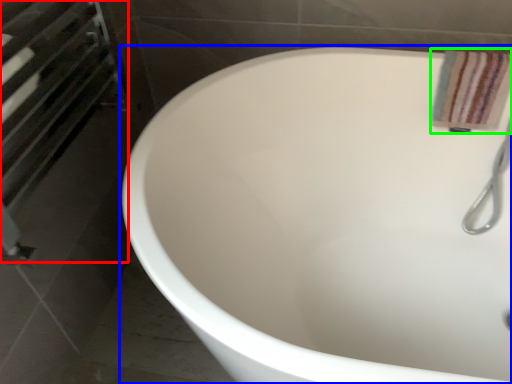
Question: Which object is positioned closest to screen door (highlighted by a red box)? Select from bathtub (highlighted by a blue box) and bath towel (highlighted by a green box).

Choices:
 (A) bathtub
 (B) bath towel

Answer: (A)